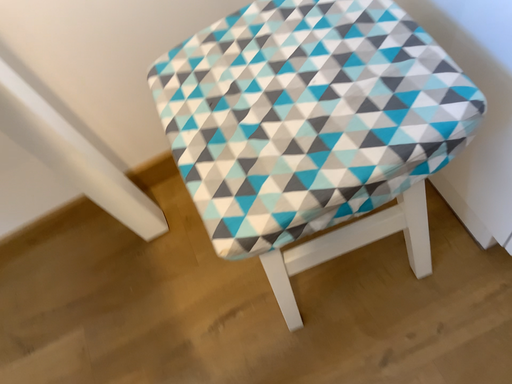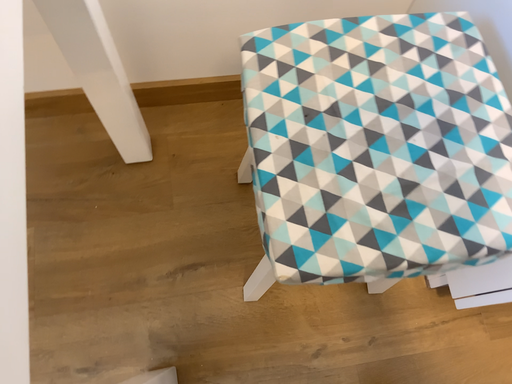
Question: Which way did the camera rotate in the video?

Choices:
 (A) rotated right
 (B) rotated left

Answer: (A)